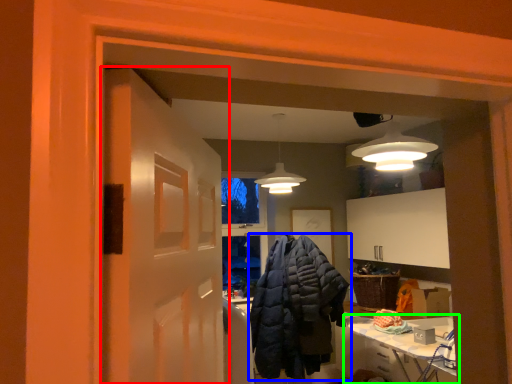
Question: Which object is the farthest from door (highlighted by a red box)? Choose among these: jacket (highlighted by a blue box) or table (highlighted by a green box).

Choices:
 (A) jacket
 (B) table

Answer: (A)